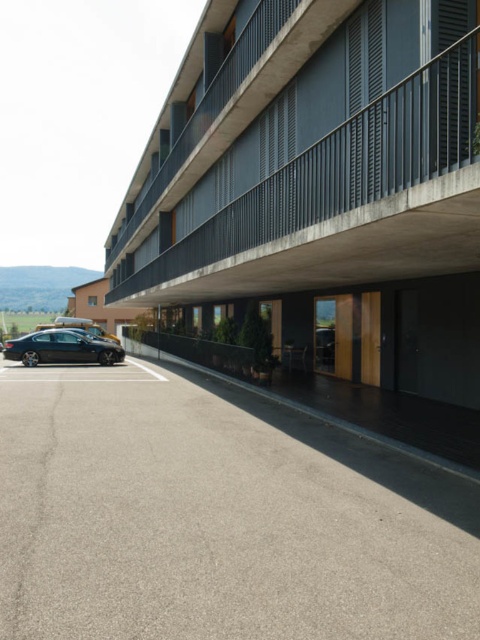
Does matte black building at center have a greater width compared to gray asphalt parking lot at lower left?

Correct, the width of matte black building at center exceeds that of gray asphalt parking lot at lower left.

Does matte black building at center lie in front of gray asphalt parking lot at lower left?

No.

Between point (432, 68) and point (285, 560), which one is positioned behind?

Point (432, 68)

Find the location of `matte black building at center`. matte black building at center is located at coordinates (326, 204).

Does point (205, 477) lie in front of point (78, 352)?

Yes, point (205, 477) is in front of point (78, 352).

Can you confirm if gray asphalt parking lot at lower left is thinner than shiny black sedan at lower left?

No.

Who is more forward, (153, 515) or (104, 353)?

Point (153, 515)

You are a GUI agent. You are given a task and a screenshot of the screen. Output one action in this format:
    pyautogui.click(x=<x>, y=<y>)
    Task: Click on the gray asphalt parking lot at lower left
    Image resolution: width=480 pixels, height=640 pixels.
    Given the screenshot: What is the action you would take?
    pyautogui.click(x=216, y=516)

Which of these two, matte black building at center or shiny black sedan at lower left, stands shorter?

shiny black sedan at lower left

Which is above, matte black building at center or shiny black sedan at lower left?

Positioned higher is matte black building at center.

Find the location of a particular element. This screenshot has width=480, height=640. matte black building at center is located at coordinates (326, 204).